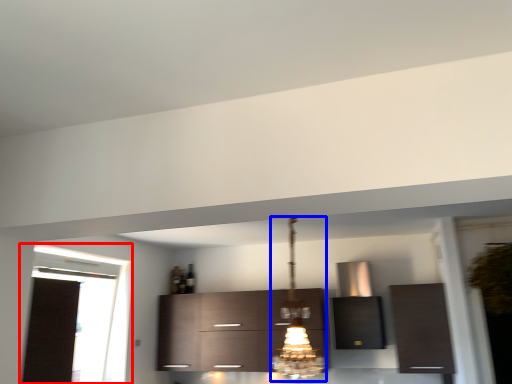
Question: Among these objects, which one is nearest to the camera, window (highlighted by a red box) or light fixture (highlighted by a blue box)?

Choices:
 (A) window
 (B) light fixture

Answer: (B)